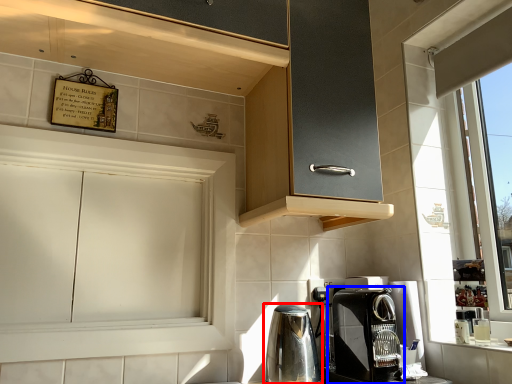
Question: Which point is closer to the camera, home appliance (highlighted by a red box) or coffee maker (highlighted by a blue box)?

Choices:
 (A) home appliance
 (B) coffee maker

Answer: (B)